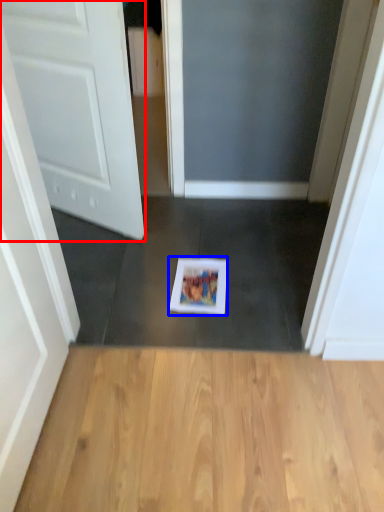
Question: Which object appears closest to the camera in this image, door (highlighted by a red box) or copy (highlighted by a blue box)?

Choices:
 (A) door
 (B) copy

Answer: (A)